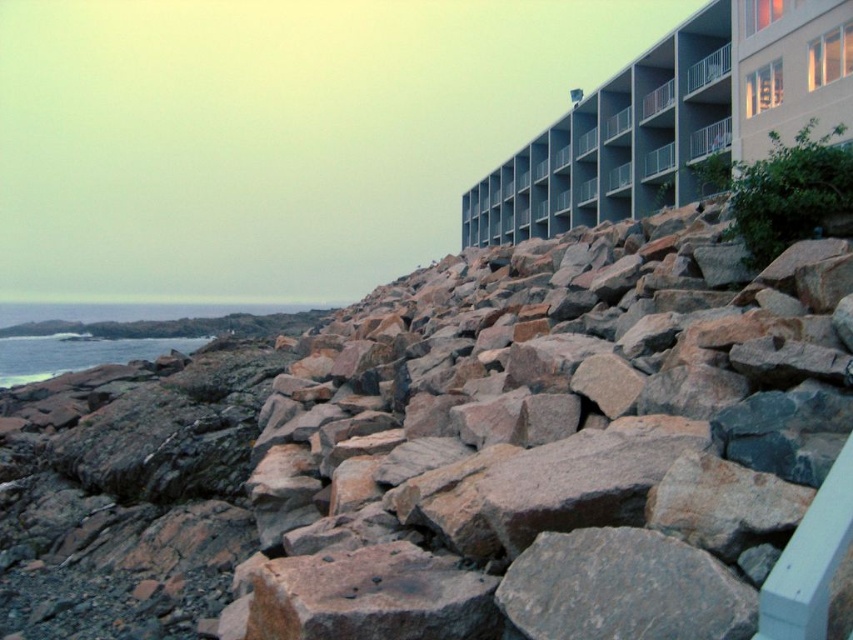
Question: In this image, where is beige concrete building at upper right located relative to smooth blue water at lower left?

Choices:
 (A) below
 (B) above

Answer: (B)

Question: Can you confirm if rusty stone boulder at center is positioned to the left of smooth blue water at lower left?

Choices:
 (A) yes
 (B) no

Answer: (B)

Question: Which point appears closest to the camera in this image?

Choices:
 (A) (547, 316)
 (B) (685, 65)
 (C) (50, 352)

Answer: (A)

Question: Which object is positioned closest to the smooth blue water at lower left?

Choices:
 (A) beige concrete building at upper right
 (B) rusty stone boulder at center

Answer: (B)

Question: Which of the following is the farthest from the observer?

Choices:
 (A) (508, 237)
 (B) (558, 348)

Answer: (A)

Question: Where is rusty stone boulder at center located in relation to beige concrete building at upper right in the image?

Choices:
 (A) below
 (B) above

Answer: (A)